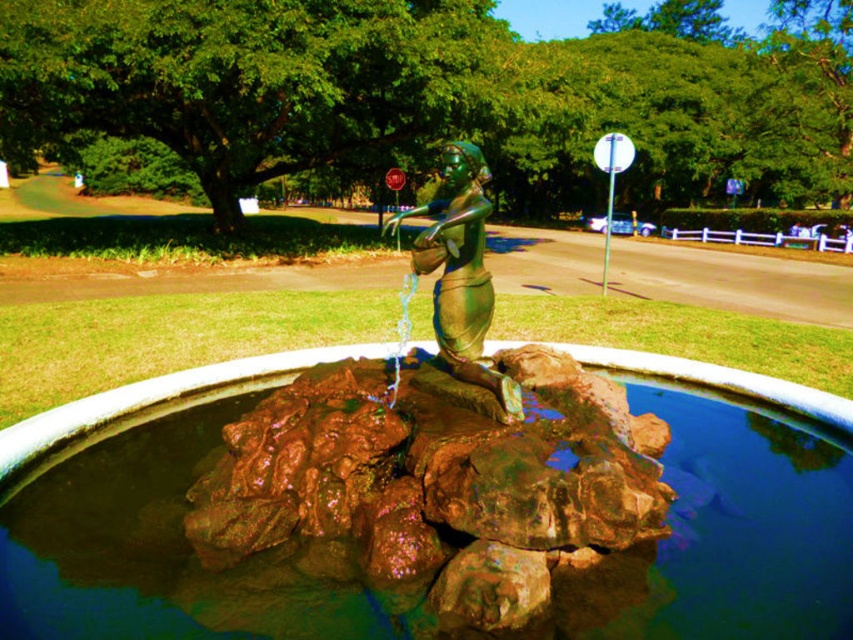
From the picture: Does brown stone water at center have a lesser width compared to green patina bronze figurine at center?

No.

Can you confirm if brown stone water at center is positioned to the left of green patina bronze figurine at center?

No, brown stone water at center is not to the left of green patina bronze figurine at center.

Which is behind, point (184, 560) or point (432, 256)?

Point (432, 256)

This screenshot has width=853, height=640. I want to click on brown stone water at center, so click(x=416, y=515).